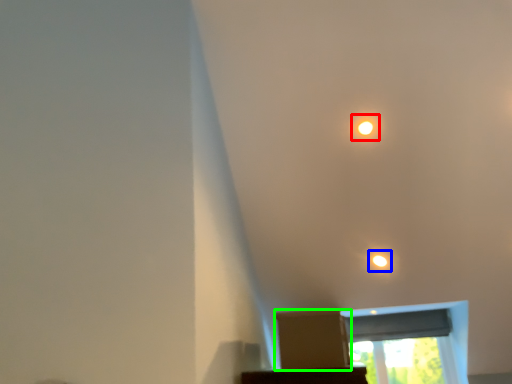
Question: Which object is the farthest from dot (highlighted by a red box)? Choose among these: light (highlighted by a blue box) or cardboard box (highlighted by a green box).

Choices:
 (A) light
 (B) cardboard box

Answer: (B)